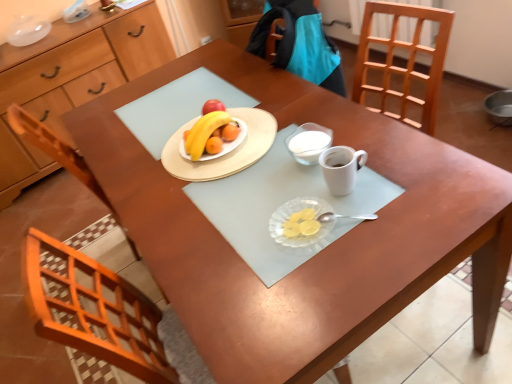
Where is `free location in front of yellow matte grapefruit at center`? The image size is (512, 384). free location in front of yellow matte grapefruit at center is located at coordinates (228, 178).